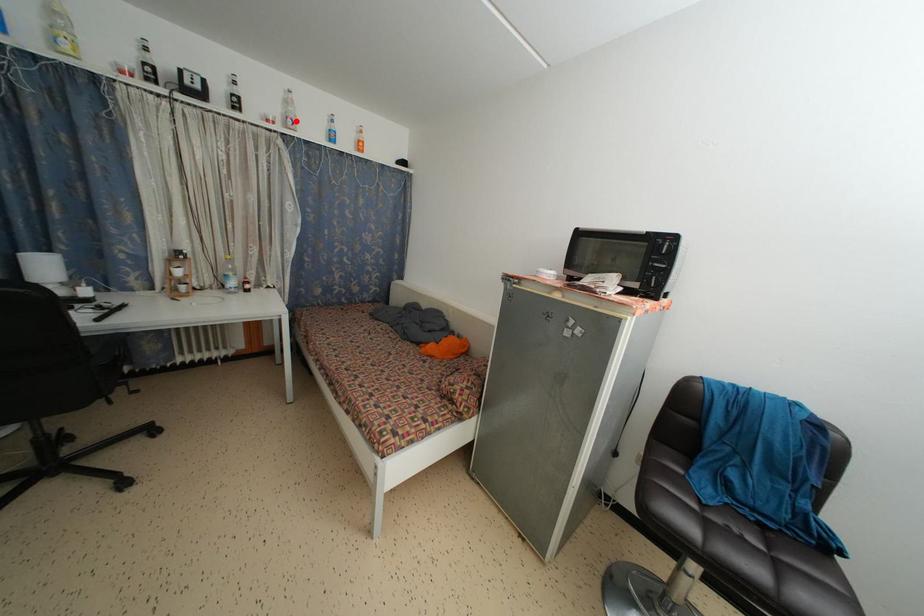
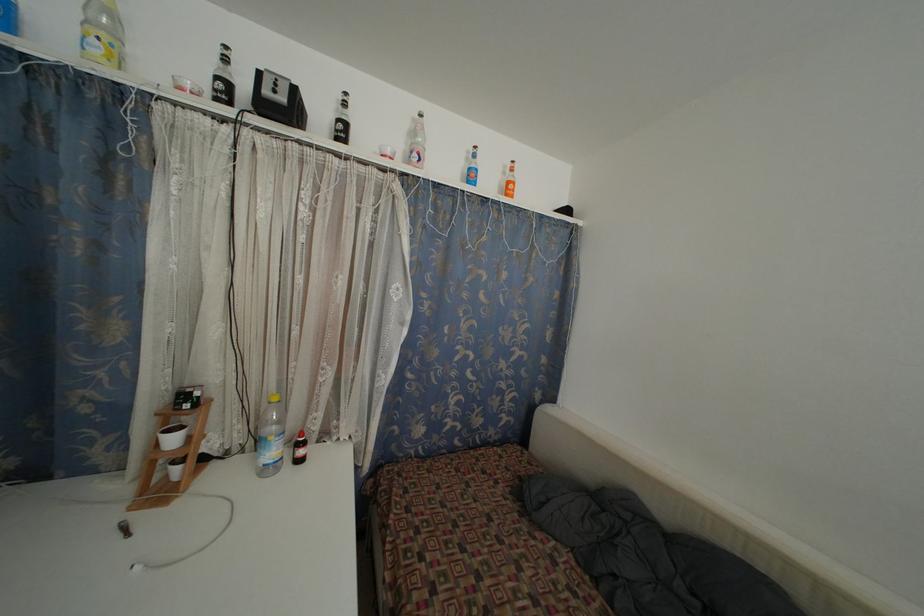
Locate, in the second image, the point that corresponds to the highlighted location in the first image.

(423, 154)